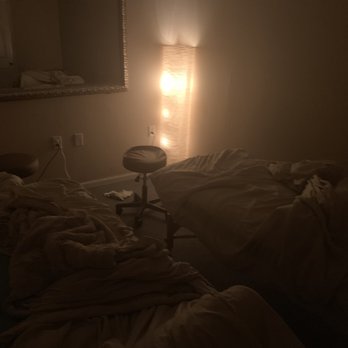
At what (x,y) coordinates should I click in order to perform the action: click on outlet. Please return your answer as a coordinate pair (x, y). This screenshot has width=348, height=348. Looking at the image, I should click on (85, 136).